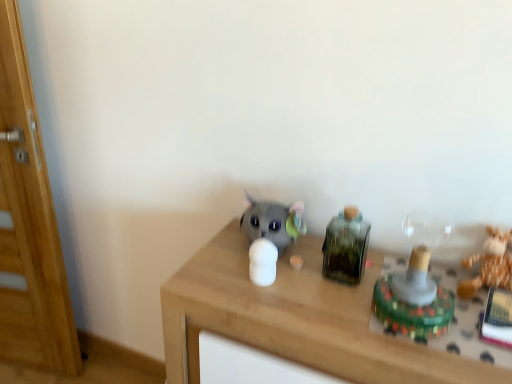
Locate an element on the screen. This screenshot has height=384, width=512. vacant space that is to the left of translucent plastic toy at right, the third toy when ordered from left to right is located at coordinates (335, 311).